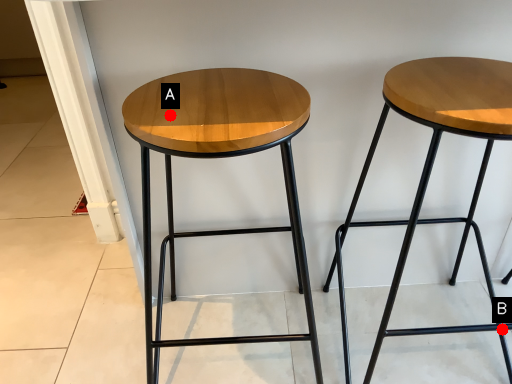
Question: Two points are circled on the image, labeled by A and B beside each circle. Which point is further to the camera?

Choices:
 (A) A is further
 (B) B is further

Answer: (B)